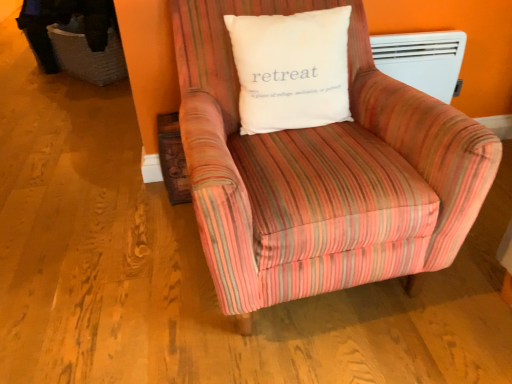
Describe the element at coordinates (422, 60) in the screenshot. I see `white plastic heater at upper right` at that location.

Find the location of a particular element. This screenshot has height=384, width=512. striped fabric armchair at center is located at coordinates (322, 173).

Considering the relative sizes of white cotton pillow at center and white plastic heater at upper right in the image provided, is white cotton pillow at center shorter than white plastic heater at upper right?

No.

Is white cotton pillow at center spatially inside white plastic heater at upper right, or outside of it?

white cotton pillow at center cannot be found inside white plastic heater at upper right.

In order to click on pillow that is in front of the white plastic heater at upper right in this screenshot , I will do `click(291, 69)`.

Does striped fabric armchair at center have a greater height compared to white cotton pillow at center?

Correct, striped fabric armchair at center is much taller as white cotton pillow at center.

From the image's perspective, is striped fabric armchair at center over white cotton pillow at center?

No, from the image's perspective, striped fabric armchair at center is not above white cotton pillow at center.

Is white plastic heater at upper right not inside white cotton pillow at center?

Yes, white plastic heater at upper right is not within white cotton pillow at center.

Can you confirm if white plastic heater at upper right is positioned to the left of white cotton pillow at center?

In fact, white plastic heater at upper right is to the right of white cotton pillow at center.

Looking at their sizes, would you say white plastic heater at upper right is wider or thinner than white cotton pillow at center?

In the image, white plastic heater at upper right appears to be more narrow than white cotton pillow at center.

From the image's perspective, which object appears higher, white cotton pillow at center or striped fabric armchair at center?

white cotton pillow at center, from the image's perspective.

Looking at this image, from a real-world perspective, between white cotton pillow at center and striped fabric armchair at center, who is vertically lower?

striped fabric armchair at center, from a real-world perspective.

This screenshot has height=384, width=512. Find the location of `pillow above the striped fabric armchair at center (from a real-world perspective)`. pillow above the striped fabric armchair at center (from a real-world perspective) is located at coordinates (291, 69).

Is the position of white cotton pillow at center less distant than that of striped fabric armchair at center?

No, it is not.

The image size is (512, 384). Find the location of `heater above the striped fabric armchair at center (from the image's perspective)`. heater above the striped fabric armchair at center (from the image's perspective) is located at coordinates (422, 60).

Between striped fabric armchair at center and white plastic heater at upper right, which one has larger size?

With larger size is striped fabric armchair at center.

Which of these two, striped fabric armchair at center or white plastic heater at upper right, stands shorter?

white plastic heater at upper right.

Looking at this image, can white plastic heater at upper right be found inside striped fabric armchair at center?

No, white plastic heater at upper right is not a part of striped fabric armchair at center.

Who is shorter, white plastic heater at upper right or striped fabric armchair at center?

With less height is white plastic heater at upper right.

Locate an element on the screen. This screenshot has height=384, width=512. heater that appears on the right of striped fabric armchair at center is located at coordinates (422, 60).

Is white plastic heater at upper right closer to the viewer compared to striped fabric armchair at center?

No, it is behind striped fabric armchair at center.

The height and width of the screenshot is (384, 512). In order to click on heater on the right side of white cotton pillow at center in this screenshot , I will do `click(422, 60)`.

This screenshot has width=512, height=384. I want to click on pillow behind the striped fabric armchair at center, so point(291,69).

When comparing their distances from white plastic heater at upper right, does white cotton pillow at center or striped fabric armchair at center seem further?

striped fabric armchair at center is further to white plastic heater at upper right.

Which object lies further to the anchor point striped fabric armchair at center, white plastic heater at upper right or white cotton pillow at center?

white plastic heater at upper right lies further to striped fabric armchair at center than the other object.

Based on their spatial positions, is white cotton pillow at center or white plastic heater at upper right closer to striped fabric armchair at center?

The object closer to striped fabric armchair at center is white cotton pillow at center.

From the image, which object appears to be farther from white plastic heater at upper right, striped fabric armchair at center or white cotton pillow at center?

striped fabric armchair at center is positioned further to the anchor white plastic heater at upper right.

Estimate the real-world distances between objects in this image. Which object is further from white cotton pillow at center, white plastic heater at upper right or striped fabric armchair at center?

white plastic heater at upper right is further to white cotton pillow at center.

Based on their spatial positions, is striped fabric armchair at center or white plastic heater at upper right closer to white cotton pillow at center?

Based on the image, striped fabric armchair at center appears to be nearer to white cotton pillow at center.

In order to click on pillow between striped fabric armchair at center and white plastic heater at upper right in the front-back direction in this screenshot , I will do (x=291, y=69).